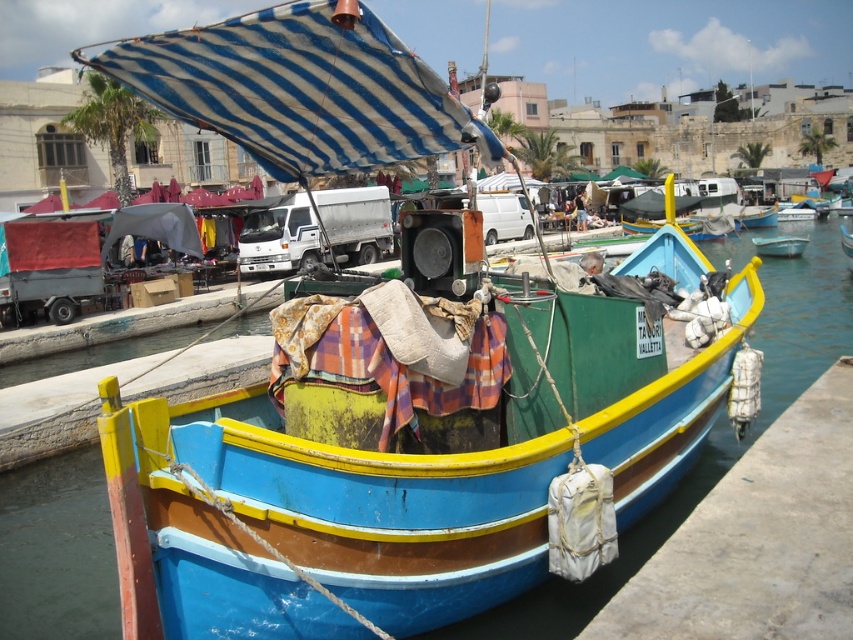
Question: Can you confirm if blue striped fabric canopy at upper center is positioned below light blue plastic boat at center?

Choices:
 (A) no
 (B) yes

Answer: (B)

Question: Is smooth concrete dock at lower right to the left of light blue plastic boat at center from the viewer's perspective?

Choices:
 (A) no
 (B) yes

Answer: (B)

Question: Can you confirm if smooth concrete dock at lower right is thinner than light blue plastic boat at center?

Choices:
 (A) no
 (B) yes

Answer: (A)

Question: Which point is farther to the camera?

Choices:
 (A) wooden boat at center
 (B) blue striped fabric canopy at upper center
 (C) light blue plastic boat at center

Answer: (C)

Question: Estimate the real-world distances between objects in this image. Which object is closer to the blue striped fabric canopy at upper center?

Choices:
 (A) wooden boat at center
 (B) smooth concrete dock at lower right

Answer: (A)

Question: Which point is farther to the camera?

Choices:
 (A) smooth concrete dock at lower right
 (B) blue striped fabric canopy at upper center
 (C) wooden boat at center

Answer: (C)